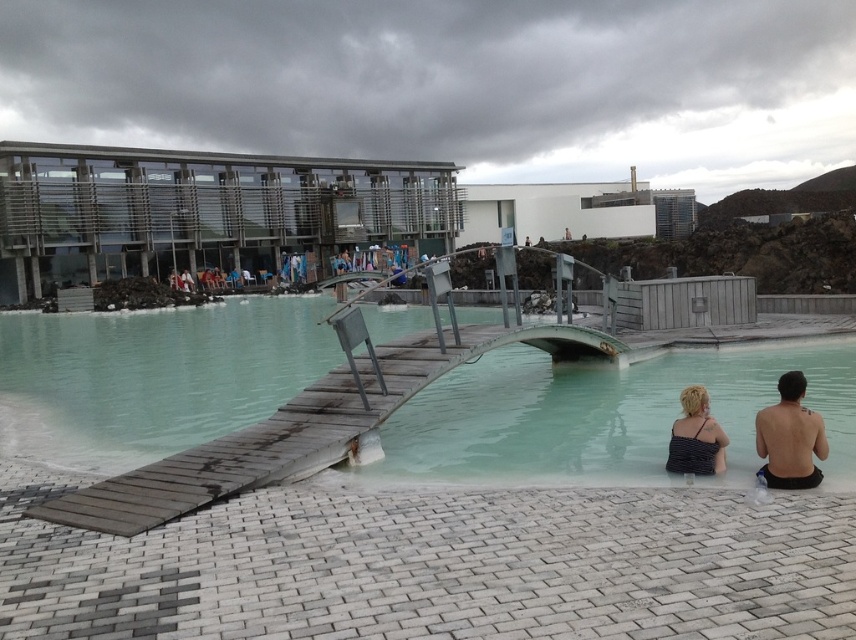
Does clear turquoise water at center have a lesser width compared to striped fabric swimsuit at lower right?

In fact, clear turquoise water at center might be wider than striped fabric swimsuit at lower right.

Who is higher up, clear turquoise water at center or striped fabric swimsuit at lower right?

Positioned higher is clear turquoise water at center.

Is point (777, 372) positioned before point (697, 464)?

That is False.

In order to click on clear turquoise water at center in this screenshot , I will do `click(604, 416)`.

What are the coordinates of `translucent wooden bridge at center` in the screenshot? It's located at (155, 376).

Does translucent wooden bridge at center appear under clear turquoise water at center?

No.

What are the coordinates of `translucent wooden bridge at center` in the screenshot? It's located at (155, 376).

Where is `translucent wooden bridge at center`? translucent wooden bridge at center is located at coordinates (155, 376).

Does translucent wooden bridge at center appear on the left side of striped fabric swimsuit at lower right?

Yes, translucent wooden bridge at center is to the left of striped fabric swimsuit at lower right.

Is translucent wooden bridge at center shorter than striped fabric swimsuit at lower right?

Incorrect, translucent wooden bridge at center's height does not fall short of striped fabric swimsuit at lower right's.

Who is more forward, (x=88, y=387) or (x=681, y=474)?

Positioned in front is point (x=681, y=474).

I want to click on translucent wooden bridge at center, so click(155, 376).